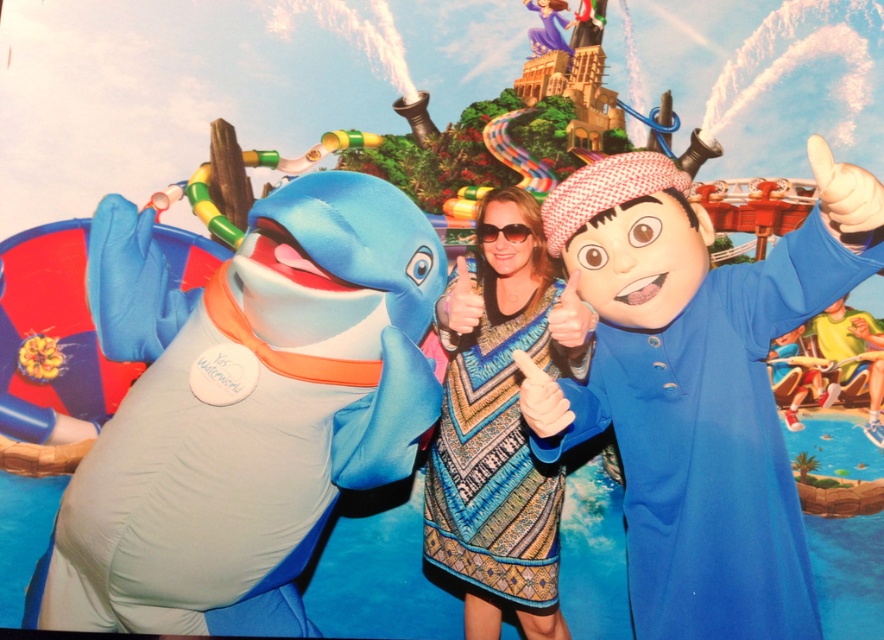
You are a photographer at Yas Waterworld and want to capture both the blue matte costume at right and the patterned fabric dress at center in a single photo. Since you want to highlight the height difference between them, which character should you position closer to the camera to make them appear taller?

To emphasize the height difference between the blue matte costume at right and the patterned fabric dress at center, position the shorter patterned fabric dress at center closer to the camera. This will make it appear taller relative to the blue matte costume at right, which is already taller in reality but can be placed farther back to maintain the natural height relationship while enhancing visual impact.

You are standing at the entrance of Yas Waterworld and want to know how far the point at coordinates (774, 584) is from you. Can you determine the distance?

The point at coordinates (774, 584) is 2.51 meters away from the viewer.